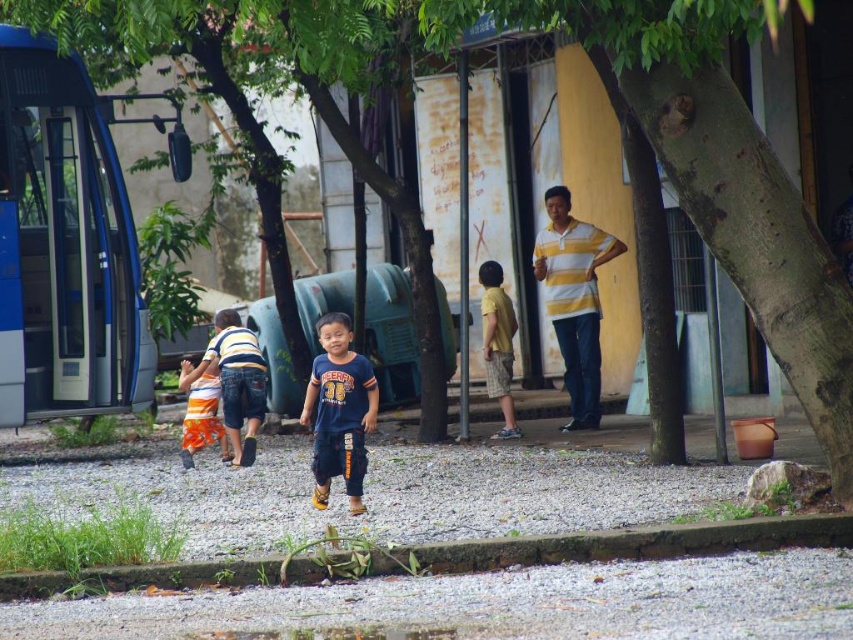
Question: Which point is farther to the camera?

Choices:
 (A) orange cotton shorts at center
 (B) yellow cotton shirt at center

Answer: (B)

Question: Can you confirm if green leafy tree at center is smaller than yellow cotton shirt at center?

Choices:
 (A) yes
 (B) no

Answer: (B)

Question: Estimate the real-world distances between objects in this image. Which object is closer to the orange striped skirt at center?

Choices:
 (A) orange cotton shorts at center
 (B) dark blue cotton shirt at center
 (C) yellow cotton shirt at center
 (D) green leafy tree at center

Answer: (A)

Question: Is orange cotton shorts at center to the left of orange striped skirt at center from the viewer's perspective?

Choices:
 (A) yes
 (B) no

Answer: (B)

Question: Is dark blue cotton shirt at center behind orange striped skirt at center?

Choices:
 (A) no
 (B) yes

Answer: (A)

Question: Which point is farther to the camera?

Choices:
 (A) orange cotton shorts at center
 (B) green leafy tree at center
 (C) orange striped skirt at center

Answer: (A)